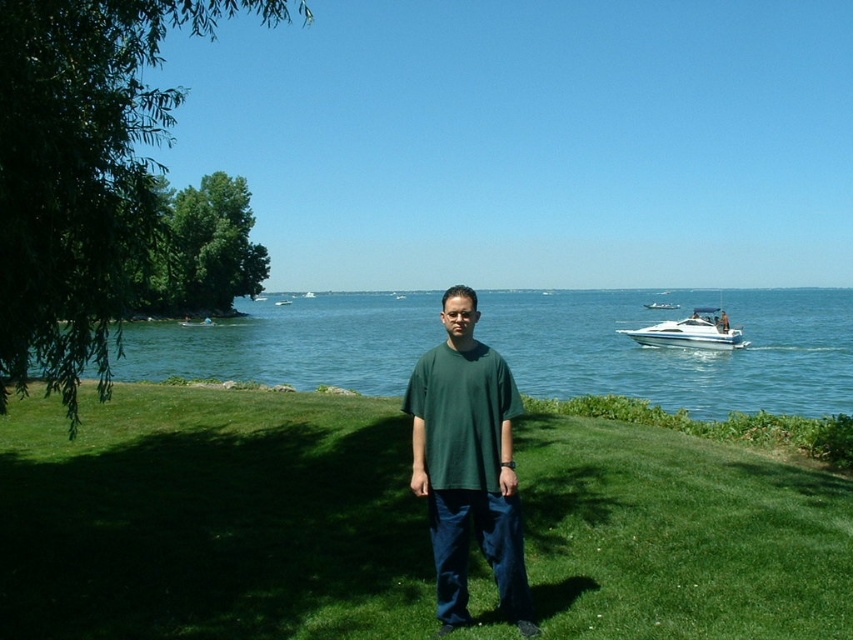
Between white glossy speedboat at right and white glossy boat at center, which one appears on the left side from the viewer's perspective?

white glossy boat at center is more to the left.

Who is more distant from viewer, (x=728, y=324) or (x=282, y=305)?

The point (x=282, y=305) is behind.

Does point (735, 346) lie in front of point (274, 301)?

Yes, it is in front of point (274, 301).

Locate an element on the screen. Image resolution: width=853 pixels, height=640 pixels. white glossy speedboat at right is located at coordinates (691, 332).

Who is more distant from viewer, (666, 301) or (277, 305)?

Point (277, 305)

Can you confirm if white glossy boat at upper right is thinner than white glossy boat at center?

Incorrect, white glossy boat at upper right's width is not less than white glossy boat at center's.

Who is more forward, (x=659, y=301) or (x=276, y=300)?

Point (x=659, y=301) is more forward.

You are a GUI agent. You are given a task and a screenshot of the screen. Output one action in this format:
    pyautogui.click(x=<x>, y=<y>)
    Task: Click on the white glossy boat at upper right
    
    Given the screenshot: What is the action you would take?
    pyautogui.click(x=660, y=305)

Between green grass at center and green matte t-shirt at center, which one appears on the left side from the viewer's perspective?

From the viewer's perspective, green grass at center appears more on the left side.

At what (x,y) coordinates should I click in order to perform the action: click on green grass at center. Please return your answer as a coordinate pair (x, y). Looking at the image, I should click on (212, 518).

In order to click on green grass at center in this screenshot , I will do `click(212, 518)`.